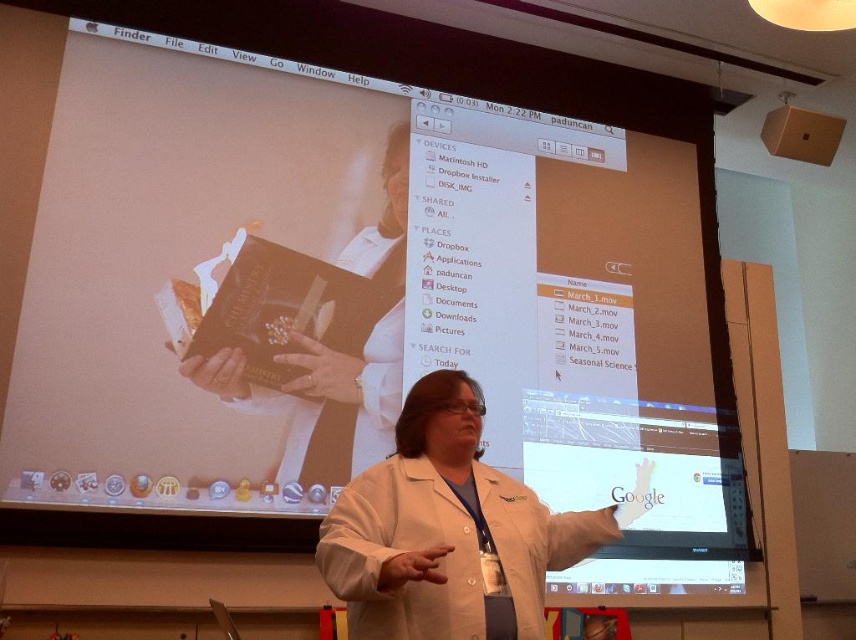
Question: Can you confirm if white lab coat at center is positioned above smooth white lab coat at center?

Choices:
 (A) no
 (B) yes

Answer: (A)

Question: Which point is closer to the camera?

Choices:
 (A) 428,396
 (B) 224,349

Answer: (A)

Question: Can you confirm if white lab coat at center is smaller than smooth white lab coat at center?

Choices:
 (A) yes
 (B) no

Answer: (A)

Question: Among these points, which one is farthest from the camera?

Choices:
 (A) (403, 170)
 (B) (397, 577)

Answer: (A)

Question: Is the position of white lab coat at center less distant than that of smooth white lab coat at center?

Choices:
 (A) no
 (B) yes

Answer: (B)